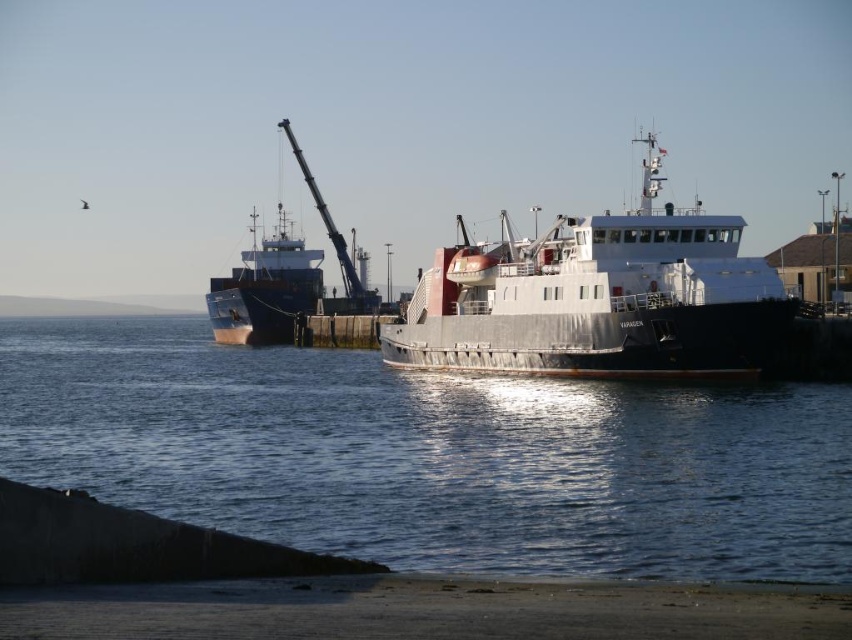
Consider the image. Measure the distance from metallic gray ferry at center to blue matte cargo ship at center.

metallic gray ferry at center is 60.81 meters away from blue matte cargo ship at center.

In the scene shown: Can you confirm if metallic gray ferry at center is positioned to the left of blue matte cargo ship at center?

Incorrect, metallic gray ferry at center is not on the left side of blue matte cargo ship at center.

Where is `metallic gray ferry at center`? This screenshot has width=852, height=640. metallic gray ferry at center is located at coordinates (597, 298).

The image size is (852, 640). In order to click on metallic gray ferry at center in this screenshot , I will do `click(597, 298)`.

Can you confirm if clear water at center is positioned to the left of metallic gray ferry at center?

Correct, you'll find clear water at center to the left of metallic gray ferry at center.

Is clear water at center taller than metallic gray ferry at center?

No, clear water at center is not taller than metallic gray ferry at center.

Measure the distance between point (740, 500) and camera.

Point (740, 500) and camera are 55.58 meters apart from each other.

This screenshot has width=852, height=640. I want to click on clear water at center, so click(430, 456).

Is clear water at center smaller than blue matte cargo ship at center?

Actually, clear water at center might be larger than blue matte cargo ship at center.

Between clear water at center and blue matte cargo ship at center, which one appears on the left side from the viewer's perspective?

From the viewer's perspective, clear water at center appears more on the left side.

Which is in front, point (111, 408) or point (320, 253)?

Point (111, 408) is more forward.

The height and width of the screenshot is (640, 852). In order to click on clear water at center in this screenshot , I will do `click(430, 456)`.